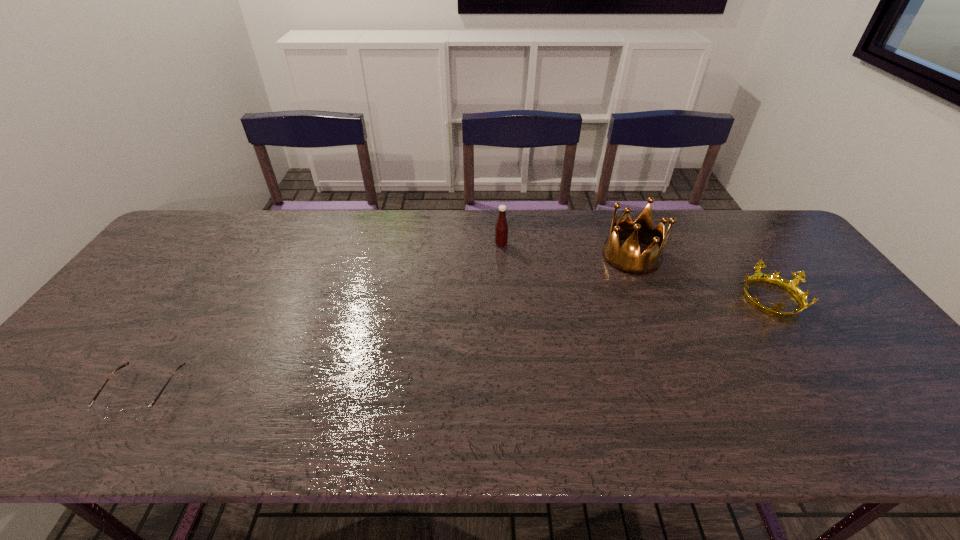
Locate an element on the screen. the taller crown is located at coordinates (627, 259).

You are a GUI agent. You are given a task and a screenshot of the screen. Output one action in this format:
    pyautogui.click(x=<x>, y=<y>)
    Task: Click on the left crown
    The height and width of the screenshot is (540, 960).
    Given the screenshot: What is the action you would take?
    pyautogui.click(x=627, y=259)

The height and width of the screenshot is (540, 960). I want to click on Tabasco sauce, so click(501, 228).

Find the location of a particular element. The width and height of the screenshot is (960, 540). the second object from left to right is located at coordinates (501, 228).

The width and height of the screenshot is (960, 540). Identify the location of the right crown. (791, 286).

Locate an element on the screen. Image resolution: width=960 pixels, height=540 pixels. the shorter crown is located at coordinates (791, 286).

This screenshot has height=540, width=960. Identify the location of the shortest object. (137, 412).

The image size is (960, 540). I want to click on spectacles, so click(137, 412).

Where is `vacant space located 0.280m on the front of the left crown`? The width and height of the screenshot is (960, 540). vacant space located 0.280m on the front of the left crown is located at coordinates (670, 350).

The height and width of the screenshot is (540, 960). I want to click on vacant region located on the front of the Tabasco sauce, so click(x=503, y=275).